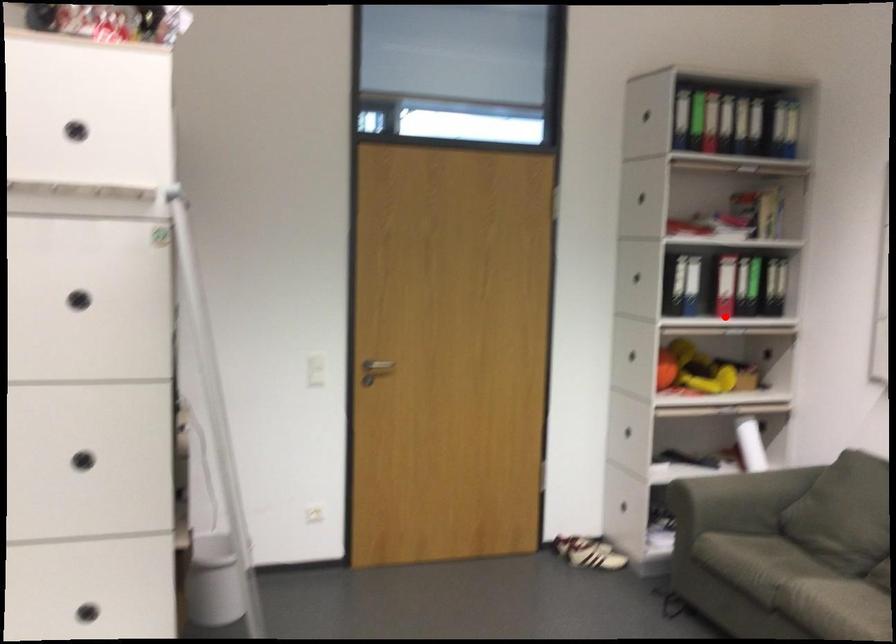
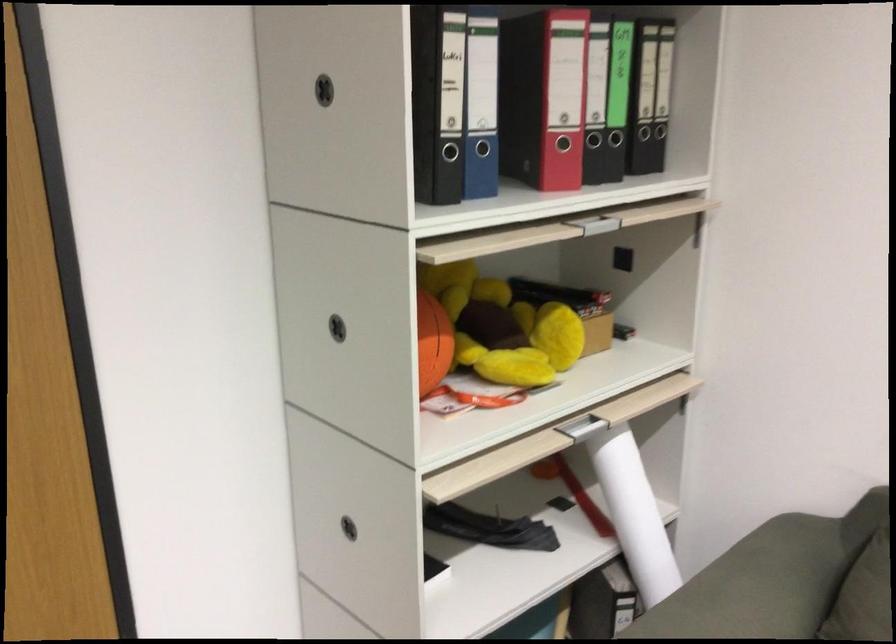
Question: I am providing you with two images of the same scene from different viewpoints. Given a red point in image1, look at the same physical point in image2. Is it:

Choices:
 (A) Closer to the viewpoint
 (B) Farther from the viewpoint

Answer: (A)